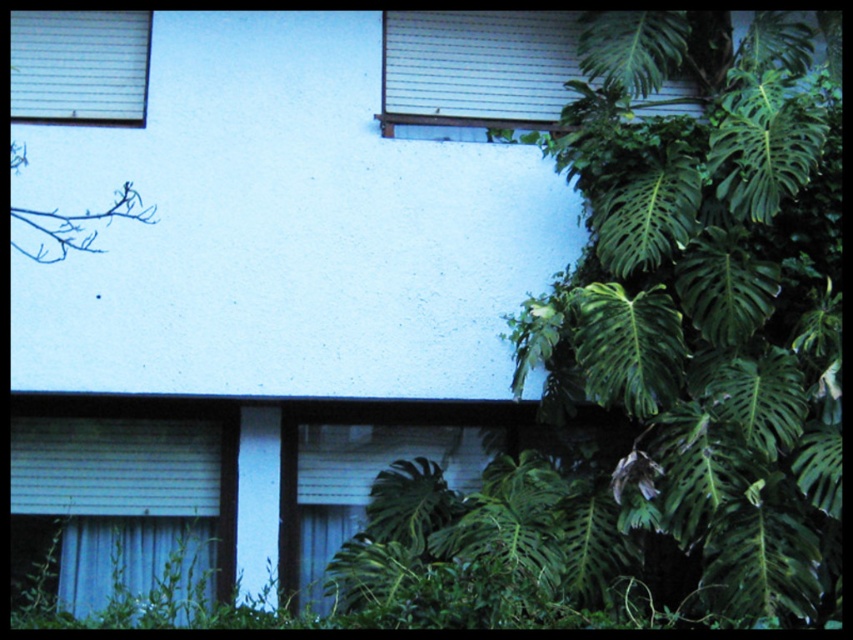
Can you confirm if white textured window at upper center is thinner than blue fabric curtain at lower left?

No.

Does white textured window at upper center have a larger size compared to blue fabric curtain at lower left?

No, white textured window at upper center is not bigger than blue fabric curtain at lower left.

Is point (433, 20) less distant than point (109, 547)?

No, (433, 20) is behind (109, 547).

This screenshot has height=640, width=853. Find the location of `white textured window at upper center`. white textured window at upper center is located at coordinates pyautogui.click(x=477, y=68).

Which of these two, white matte window at upper left or blue fabric curtain at lower left, stands taller?

white matte window at upper left is taller.

Where is `white matte window at upper left`? white matte window at upper left is located at coordinates (79, 67).

This screenshot has width=853, height=640. Identify the location of white matte window at upper left. (79, 67).

How distant is white textured window at upper center from white matte window at upper left?

white textured window at upper center and white matte window at upper left are 1.57 meters apart from each other.

Who is positioned more to the left, white textured window at upper center or white matte window at upper left?

Positioned to the left is white matte window at upper left.

Between point (433, 19) and point (84, 74), which one is positioned behind?

Point (433, 19)

Where is `white textured window at upper center`? white textured window at upper center is located at coordinates (477, 68).